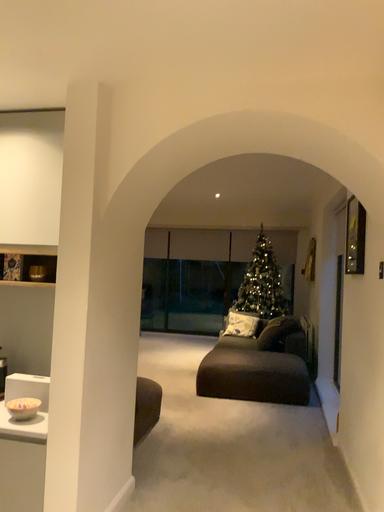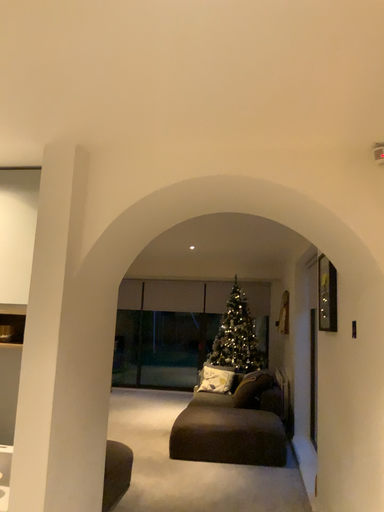
Question: How did the camera likely rotate when shooting the video?

Choices:
 (A) rotated downward
 (B) rotated upward

Answer: (B)